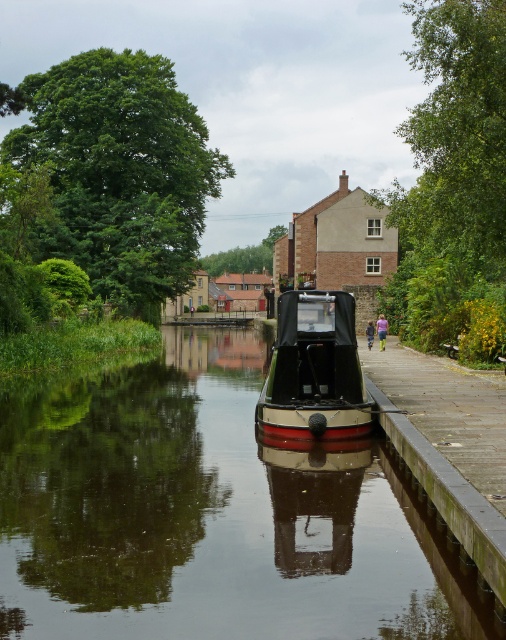
You are a delivery drone operator. Your drone needs to fly from the smooth black water at center to the polished wood boat at center. What is the horizontal distance you need to cover?

The horizontal distance between the smooth black water at center and the polished wood boat at center is 25.40 feet.

You are standing on the pathway on the right side of the canal and want to take a photo of the smooth black water at center and the polished wood boat at center. Which object should you focus on first to ensure both are in the frame?

The smooth black water at center is in front of the polished wood boat at center, so you should focus on the polished wood boat at center first to ensure both are in the frame.